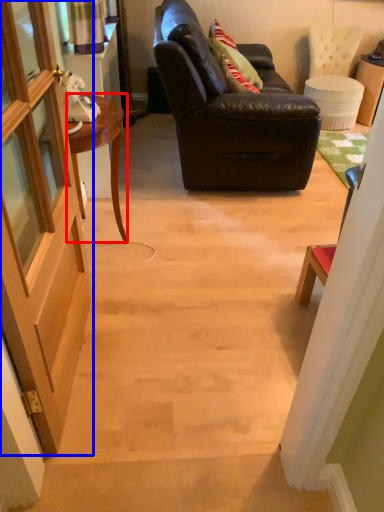
Question: Which point is closer to the camera, desk (highlighted by a red box) or door (highlighted by a blue box)?

Choices:
 (A) desk
 (B) door

Answer: (B)